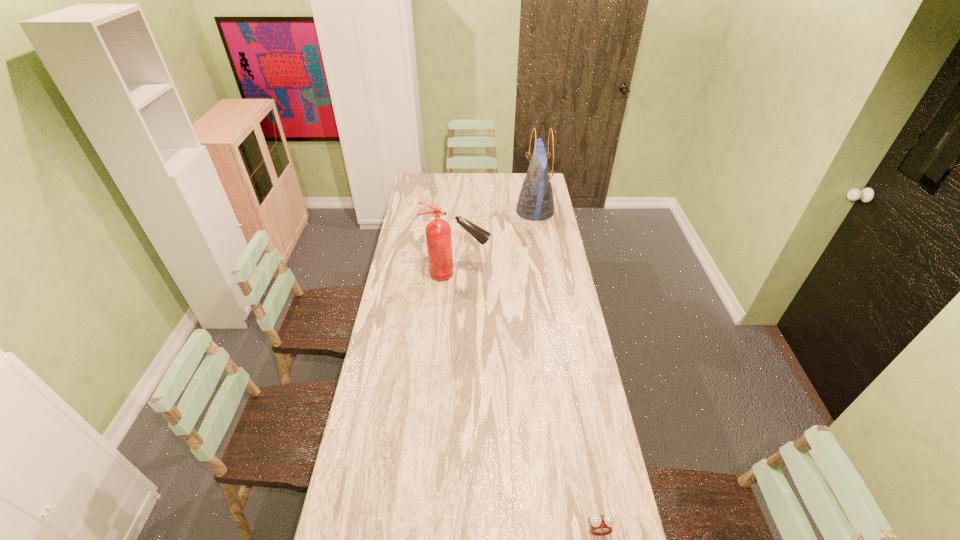
Identify the location of alarm clock present at the right edge. (600, 525).

This screenshot has width=960, height=540. What are the coordinates of `blank area at the far edge` in the screenshot? It's located at (458, 190).

You are a GUI agent. You are given a task and a screenshot of the screen. Output one action in this format:
    pyautogui.click(x=<x>, y=<y>)
    Task: Click on the vacant space at the left edge
    The width and height of the screenshot is (960, 540).
    Given the screenshot: What is the action you would take?
    pyautogui.click(x=409, y=242)

You are a GUI agent. You are given a task and a screenshot of the screen. Output one action in this format:
    pyautogui.click(x=<x>, y=<y>)
    Task: Click on the free space at the right edge
    The width and height of the screenshot is (960, 540).
    Given the screenshot: What is the action you would take?
    pyautogui.click(x=557, y=400)

In the image, there is a desktop. At what (x,y) coordinates should I click in order to perform the action: click on free space at the far left corner. Please return your answer as a coordinate pair (x, y). The height and width of the screenshot is (540, 960). Looking at the image, I should click on (423, 187).

Find the location of a particular element. This screenshot has height=540, width=960. vacant space that is in between the nearest object and the fire extinguisher is located at coordinates (528, 402).

Where is `vacant space in between the farthest object and the leftmost object`? vacant space in between the farthest object and the leftmost object is located at coordinates (496, 243).

Locate an element on the screen. vacant space in between the shortest object and the shopping bag is located at coordinates (566, 371).

At what (x,y) coordinates should I click in order to perform the action: click on free space that is in between the farthest object and the leftmost object. Please return your answer as a coordinate pair (x, y). Looking at the image, I should click on (496, 243).

This screenshot has width=960, height=540. I want to click on the closest object to the farthest object, so click(x=438, y=231).